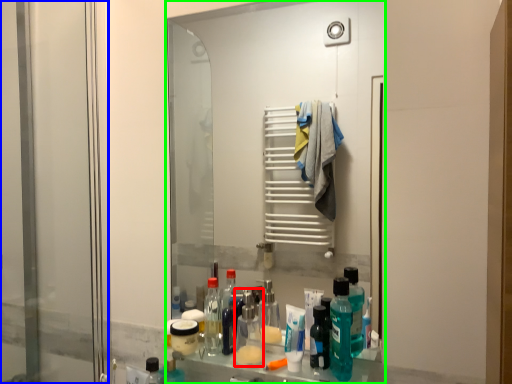
Question: Estimate the real-world distances between objects in this image. Which object is closer to mouthwash (highlighted by a red box), screen door (highlighted by a blue box) or mirror (highlighted by a green box)?

Choices:
 (A) screen door
 (B) mirror

Answer: (A)